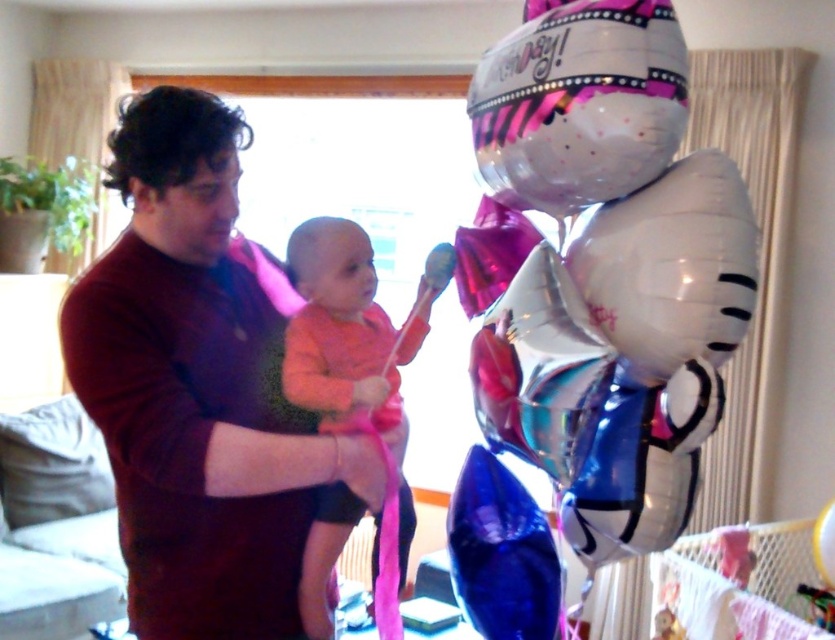
Can you confirm if metallic silver balloons at right is positioned below matte dark red shirt at center?

Incorrect, metallic silver balloons at right is not positioned below matte dark red shirt at center.

Which is in front, point (509, 48) or point (256, 284)?

Point (509, 48) is more forward.

At what (x,y) coordinates should I click in order to perform the action: click on metallic silver balloons at right. Please return your answer as a coordinate pair (x, y). This screenshot has width=835, height=640. Looking at the image, I should click on (601, 269).

Which is above, metallic silver balloons at right or orange soft fabric baby at center?

Positioned higher is metallic silver balloons at right.

Does point (496, 296) lie behind point (397, 545)?

Yes, it is behind point (397, 545).

Is point (621, 504) farther from camera compared to point (307, 355)?

Yes, it is behind point (307, 355).

Where is `metallic silver balloons at right`? This screenshot has height=640, width=835. metallic silver balloons at right is located at coordinates (601, 269).

Is matte dark red shirt at center shorter than blue metallic balloon at right?

In fact, matte dark red shirt at center may be taller than blue metallic balloon at right.

Does matte dark red shirt at center have a larger size compared to blue metallic balloon at right?

Correct, matte dark red shirt at center is larger in size than blue metallic balloon at right.

This screenshot has height=640, width=835. Identify the location of matte dark red shirt at center. (200, 387).